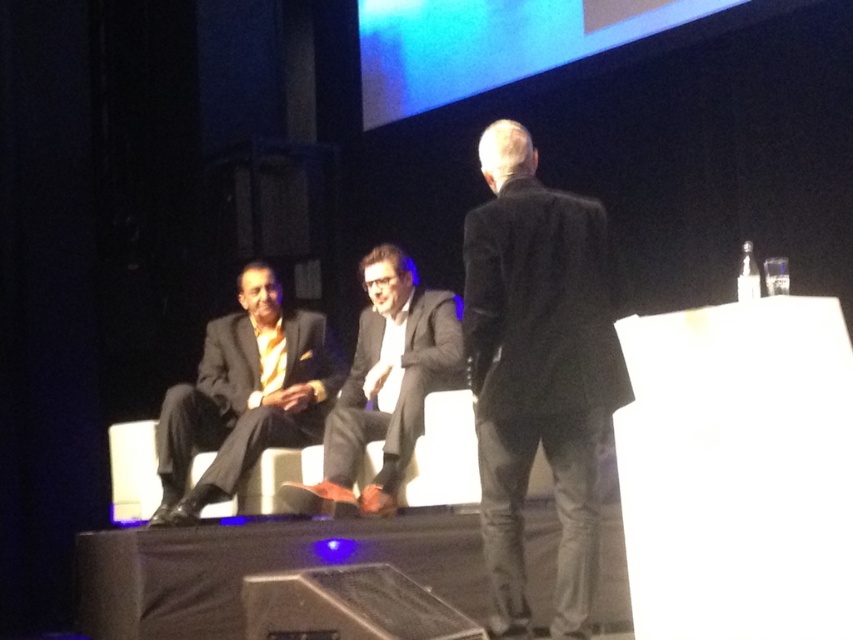
You are an event planner trying to arrange seating for two guests wearing the black matte suit at center and the matte black suit at center. Since both are wearing similar attire, you need to distinguish them based on their clothing. Which guest has a narrower torso?

The black matte suit at center has a narrower torso compared to the matte black suit at center because the black matte suit at center is thinner than matte black suit at center.

You are organizing a stage setup for an event and need to place the matte black suit at center and the metallic silver speaker at lower center. Given their sizes, which object should be placed closer to the audience to ensure visibility?

The matte black suit at center is larger in size compared to the metallic silver speaker at lower center. To ensure visibility, the larger matte black suit at center should be placed closer to the audience so it can be seen clearly.

You are an event photographer at the conference. You need to capture a clear photo of the black matte suit at center without the matte black suit at center blocking it. Based on their positions, is this possible?

The black matte suit at center is in front of the matte black suit at center, so it is possible to capture a clear photo of the black matte suit at center without the matte black suit at center blocking it.